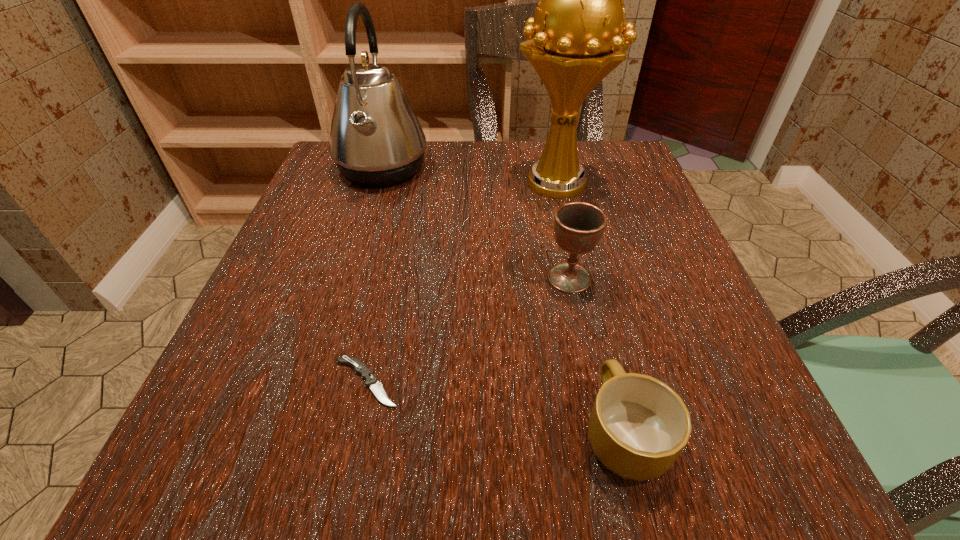
This screenshot has width=960, height=540. Identify the location of the tallest object. (573, 42).

Locate an element on the screen. The image size is (960, 540). kettle is located at coordinates (376, 139).

Where is `the third tallest object`? Image resolution: width=960 pixels, height=540 pixels. the third tallest object is located at coordinates (578, 226).

In order to click on the third nearest object in this screenshot , I will do `click(578, 226)`.

Where is `the second shortest object`? The width and height of the screenshot is (960, 540). the second shortest object is located at coordinates (638, 426).

The width and height of the screenshot is (960, 540). Find the location of `pocketknife`. pocketknife is located at coordinates (360, 368).

Identify the location of vacant space located 0.280m at the front of the tallest object where the globe is prominent. (587, 311).

Where is `free space located 0.090m from the spout of the fourth shortest object`? This screenshot has height=540, width=960. free space located 0.090m from the spout of the fourth shortest object is located at coordinates (467, 170).

Image resolution: width=960 pixels, height=540 pixels. What are the coordinates of `free space located 0.330m on the left of the chalice` in the screenshot? It's located at (356, 278).

This screenshot has height=540, width=960. Find the location of `free space located 0.110m on the side with the handle of the mug`. free space located 0.110m on the side with the handle of the mug is located at coordinates (597, 323).